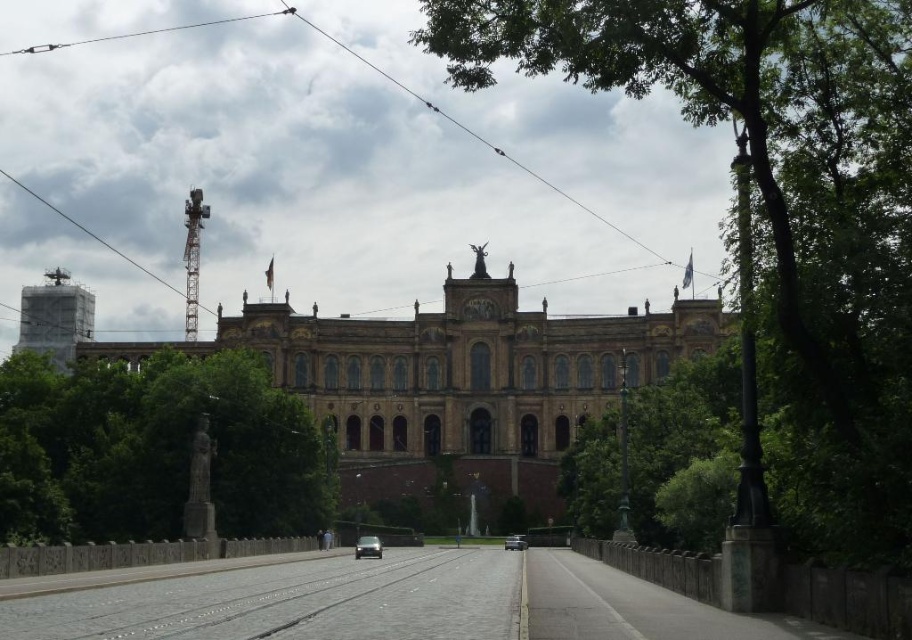
Question: Does metallic tower at upper left have a greater width compared to metallic silver car at center?

Choices:
 (A) yes
 (B) no

Answer: (A)

Question: Which object appears farthest from the camera in this image?

Choices:
 (A) green leafy tree at upper right
 (B) brown stone building at center
 (C) metallic tower at upper left
 (D) shiny black car at center

Answer: (C)

Question: Can you confirm if green leafy tree at upper right is positioned above green leafy tree at left?

Choices:
 (A) yes
 (B) no

Answer: (A)

Question: Can you confirm if black wire at upper center is smaller than shiny black car at center?

Choices:
 (A) yes
 (B) no

Answer: (B)

Question: Which point is closer to the camera?

Choices:
 (A) (566, 448)
 (B) (584, 76)
 (C) (261, 13)

Answer: (A)

Question: Which of the following is the farthest from the observer?

Choices:
 (A) metallic silver car at center
 (B) green leafy tree at upper right

Answer: (A)